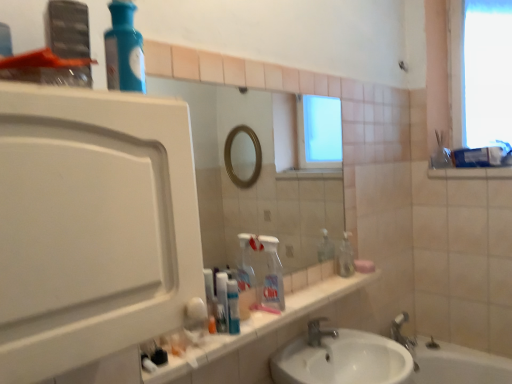
Question: From a real-world perspective, is white plastic toothpaste tube at center physically located above or below blue glass bottle at upper left, which is the 1th cleaning product in left-to-right order?

Choices:
 (A) above
 (B) below

Answer: (B)

Question: Is white plastic toothpaste tube at center bigger or smaller than blue glass bottle at upper left, which ranks as the 2th cleaning product in bottom-to-top order?

Choices:
 (A) big
 (B) small

Answer: (B)

Question: Estimate the real-world distances between objects in this image. Which object is closer to the pink matte soap at right?

Choices:
 (A) clear plastic bottle at center, the 2th cleaning product positioned from the front
 (B) blue glass bottle at upper left, which ranks as the 2th cleaning product in bottom-to-top order
 (C) white glossy sink at lower center
 (D) silver metallic faucet at sink center
 (E) translucent plastic soap dispenser at center

Answer: (E)

Question: Which is nearer to the translucent plastic soap dispenser at center?

Choices:
 (A) white glossy sink at lower center
 (B) white plastic toothpaste tube at center
 (C) white matte cabinet at left
 (D) blue glass bottle at upper left, which is the 1th cleaning product in left-to-right order
 (E) pink matte soap at right

Answer: (E)